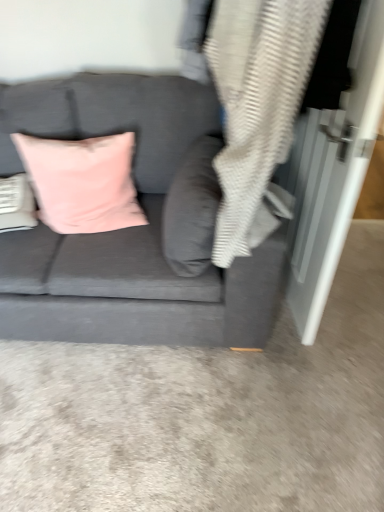
Question: Would you say pink velvet cushion at upper left, which ranks as the second pillow in right-to-left order, is inside or outside velvet pink pillow at center, marked as the first pillow in a right-to-left arrangement?

Choices:
 (A) outside
 (B) inside

Answer: (A)

Question: Is pink velvet cushion at upper left, positioned as the first pillow in left-to-right order, to the left or to the right of velvet pink pillow at center, marked as the first pillow in a right-to-left arrangement, in the image?

Choices:
 (A) left
 (B) right

Answer: (A)

Question: Which object is positioned farthest from the pink velvet cushion at upper left, which ranks as the second pillow in right-to-left order?

Choices:
 (A) gray textured blanket at upper right
 (B) velvet pink pillow at center, arranged as the 2th pillow when viewed from the left
 (C) velvet gray couch at center

Answer: (A)

Question: Which object is positioned farthest from the velvet gray couch at center?

Choices:
 (A) gray textured blanket at upper right
 (B) velvet pink pillow at center, marked as the first pillow in a right-to-left arrangement
 (C) pink velvet cushion at upper left, which ranks as the second pillow in right-to-left order

Answer: (A)